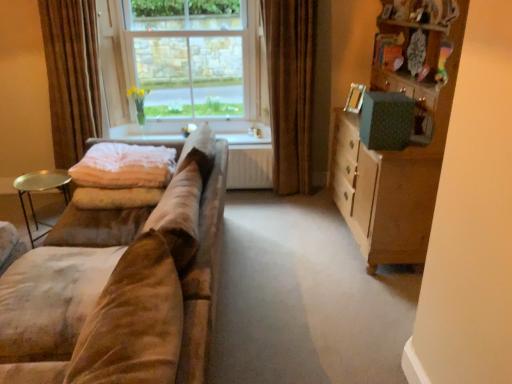
Question: Is clear glass window at center oriented away from brown velvet curtain at center, the 2th curtain viewed from the left?

Choices:
 (A) yes
 (B) no

Answer: (B)

Question: Is clear glass window at center wider than brown velvet curtain at center, the 1th curtain positioned from the right?

Choices:
 (A) no
 (B) yes

Answer: (A)

Question: Is clear glass window at center beside brown velvet curtain at center, the 1th curtain positioned from the right?

Choices:
 (A) no
 (B) yes

Answer: (A)

Question: Considering the relative positions of clear glass window at center and brown velvet curtain at center, the 1th curtain positioned from the right, in the image provided, is clear glass window at center in front of brown velvet curtain at center, the 1th curtain positioned from the right,?

Choices:
 (A) no
 (B) yes

Answer: (A)

Question: Is brown velvet curtain at center, the 2th curtain viewed from the left, surrounded by clear glass window at center?

Choices:
 (A) yes
 (B) no

Answer: (B)

Question: Is clear glass window at center not inside brown velvet curtain at center, the 2th curtain viewed from the left?

Choices:
 (A) yes
 (B) no

Answer: (A)

Question: Is clear glass window at center behind wooden cabinet at right?

Choices:
 (A) no
 (B) yes

Answer: (B)

Question: Is clear glass window at center oriented towards wooden cabinet at right?

Choices:
 (A) yes
 (B) no

Answer: (B)

Question: Is clear glass window at center wider than wooden cabinet at right?

Choices:
 (A) no
 (B) yes

Answer: (A)

Question: Is clear glass window at center positioned beyond the bounds of wooden cabinet at right?

Choices:
 (A) yes
 (B) no

Answer: (A)

Question: Considering the relative sizes of clear glass window at center and wooden cabinet at right in the image provided, is clear glass window at center thinner than wooden cabinet at right?

Choices:
 (A) no
 (B) yes

Answer: (B)

Question: From a real-world perspective, does clear glass window at center stand above wooden cabinet at right?

Choices:
 (A) yes
 (B) no

Answer: (A)

Question: Does wooden cabinet at right have a greater height compared to white glossy window sill at center?

Choices:
 (A) yes
 (B) no

Answer: (A)